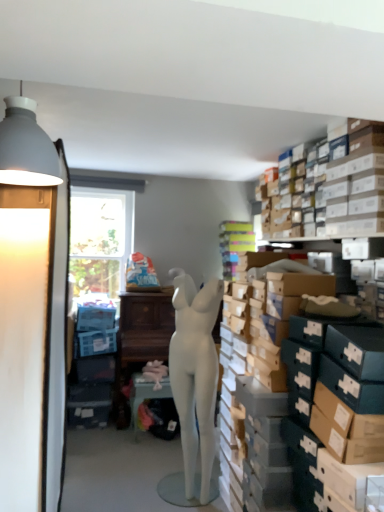
I want to click on white matte lampshade at upper left, so click(26, 146).

What do you see at coordinates (25, 302) in the screenshot? I see `matte white lampshade at left` at bounding box center [25, 302].

The width and height of the screenshot is (384, 512). What do you see at coordinates (145, 395) in the screenshot? I see `matte white table at center` at bounding box center [145, 395].

Describe the element at coordinates (195, 373) in the screenshot. I see `white matte mannequin at center` at that location.

The width and height of the screenshot is (384, 512). What are the coordinates of `white matte mannequin at center` in the screenshot? It's located at (195, 373).

Image resolution: width=384 pixels, height=512 pixels. I want to click on white matte lampshade at upper left, so click(26, 146).

Considering the relative positions of matte white lampshade at left and white matte mannequin at center in the image provided, is matte white lampshade at left in front of white matte mannequin at center?

Yes, matte white lampshade at left is closer to the viewer.

Based on the photo, is white matte mannequin at center located within matte white lampshade at left?

No, matte white lampshade at left does not contain white matte mannequin at center.

Considering the sizes of objects matte white lampshade at left and white matte mannequin at center in the image provided, who is thinner, matte white lampshade at left or white matte mannequin at center?

Thinner between the two is white matte mannequin at center.

From a real-world perspective, is matte white lampshade at left positioned over white matte mannequin at center based on gravity?

Yes, from a real-world perspective, matte white lampshade at left is over white matte mannequin at center

Locate an element on the screen. This screenshot has width=384, height=512. table lamp in front of the matte white table at center is located at coordinates (25, 302).

Between point (23, 438) and point (167, 394), which one is positioned in front?

Positioned in front is point (23, 438).

Is matte white lampshade at left placed right next to matte white table at center?

matte white lampshade at left is not next to matte white table at center, and they're not touching.

Would you say matte white lampshade at left is outside matte white table at center?

Yes, matte white lampshade at left is located beyond the bounds of matte white table at center.

Would you say matte white table at center is outside white matte mannequin at center?

Yes.

How much distance is there between matte white table at center and white matte mannequin at center?

They are 3.32 feet apart.

Is matte white table at center behind white matte mannequin at center?

Yes, the depth of matte white table at center is greater than that of white matte mannequin at center.

Is matte white table at center to the right of white matte mannequin at center from the viewer's perspective?

No.

Looking at this image, is white matte lampshade at upper left bigger or smaller than matte white lampshade at left?

Clearly, white matte lampshade at upper left is smaller in size than matte white lampshade at left.

Is white matte lampshade at upper left oriented towards matte white lampshade at left?

Yes.

From the image's perspective, is white matte lampshade at upper left above or below matte white lampshade at left?

white matte lampshade at upper left is above matte white lampshade at left.

Is point (6, 135) positioned behind point (139, 373)?

No, (6, 135) is closer to viewer.

Is white matte lampshade at upper left oriented away from matte white table at center?

white matte lampshade at upper left is not turned away from matte white table at center.

Is white matte lampshade at upper left to the left of matte white table at center from the viewer's perspective?

Indeed, white matte lampshade at upper left is positioned on the left side of matte white table at center.

Would you say white matte lampshade at upper left is outside matte white table at center?

Yes.

From the image's perspective, is matte white lampshade at left on white matte lampshade at upper left?

No, from the image's perspective, matte white lampshade at left is not over white matte lampshade at upper left.

Is matte white lampshade at left far from white matte lampshade at upper left?

No, matte white lampshade at left is not far away from white matte lampshade at upper left.

From a real-world perspective, relative to white matte lampshade at upper left, is matte white lampshade at left vertically above or below?

Clearly, from a real-world perspective, matte white lampshade at left is below white matte lampshade at upper left.

What's the angular difference between matte white lampshade at left and white matte lampshade at upper left's facing directions?

The angle between the facing direction of matte white lampshade at left and the facing direction of white matte lampshade at upper left is 175 degrees.

From a real-world perspective, is white matte lampshade at upper left physically above white matte mannequin at center?

Yes, from a real-world perspective, white matte lampshade at upper left is on top of white matte mannequin at center.

Is white matte mannequin at center completely or partially inside white matte lampshade at upper left?

No, white matte mannequin at center is not inside white matte lampshade at upper left.

Measure the distance from white matte lampshade at upper left to white matte mannequin at center.

5.07 feet.

Based on the photo, from the image's perspective, between white matte lampshade at upper left and white matte mannequin at center, who is located below?

From the image's view, white matte mannequin at center is below.

This screenshot has height=512, width=384. In order to click on person behind the matte white lampshade at left in this screenshot , I will do `click(195, 373)`.

Where is `table located below the matte white lampshade at left (from the image's perspective)`? table located below the matte white lampshade at left (from the image's perspective) is located at coordinates (145, 395).

Looking at the image, which one is located closer to white matte mannequin at center, matte white lampshade at left or white matte lampshade at upper left?

matte white lampshade at left lies closer to white matte mannequin at center than the other object.

Considering their positions, is white matte mannequin at center positioned closer to matte white lampshade at left than white matte lampshade at upper left?

Among the two, white matte lampshade at upper left is located nearer to matte white lampshade at left.

Which object lies further to the anchor point matte white lampshade at left, white matte lampshade at upper left or white matte mannequin at center?

The object further to matte white lampshade at left is white matte mannequin at center.

From the image, which object appears to be nearer to white matte lampshade at upper left, matte white table at center or white matte mannequin at center?

white matte mannequin at center is closer to white matte lampshade at upper left.

When comparing their distances from matte white lampshade at left, does matte white table at center or white matte lampshade at upper left seem further?

matte white table at center is further to matte white lampshade at left.

Looking at the image, which one is located closer to matte white table at center, white matte mannequin at center or matte white lampshade at left?

Among the two, white matte mannequin at center is located nearer to matte white table at center.

Estimate the real-world distances between objects in this image. Which object is closer to white matte lampshade at upper left, matte white lampshade at left or white matte mannequin at center?

matte white lampshade at left lies closer to white matte lampshade at upper left than the other object.

In the scene shown: When comparing their distances from matte white lampshade at left, does white matte lampshade at upper left or matte white table at center seem closer?

white matte lampshade at upper left.

Where is `person between white matte lampshade at upper left and matte white table at center from front to back`? This screenshot has width=384, height=512. person between white matte lampshade at upper left and matte white table at center from front to back is located at coordinates (195, 373).

You are a GUI agent. You are given a task and a screenshot of the screen. Output one action in this format:
    pyautogui.click(x=<x>, y=<y>)
    Task: Click on the table lamp between white matte lampshade at upper left and white matte mannequin at center in the vertical direction
    
    Given the screenshot: What is the action you would take?
    pyautogui.click(x=25, y=302)

At what (x,y) coordinates should I click in order to perform the action: click on person positioned between matte white lampshade at left and matte white table at center from near to far. Please return your answer as a coordinate pair (x, y). Image resolution: width=384 pixels, height=512 pixels. Looking at the image, I should click on (195, 373).

Identify the location of table lamp between white matte lampshade at upper left and matte white table at center from front to back. This screenshot has height=512, width=384. (25, 302).